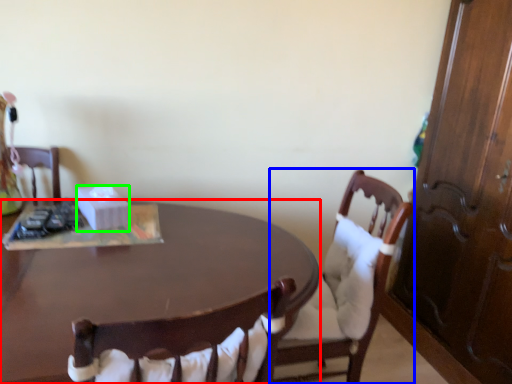
Question: Which object is the farthest from desk (highlighted by a red box)? Choose among these: chair (highlighted by a blue box) or box (highlighted by a green box).

Choices:
 (A) chair
 (B) box

Answer: (A)